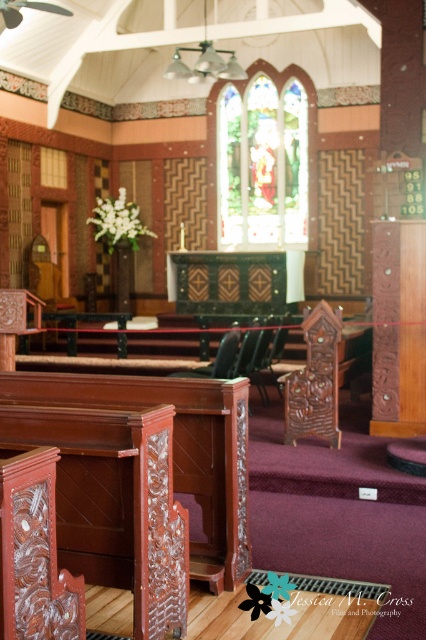
Question: Can you confirm if stained glass at center is thinner than wooden carved chair at center?

Choices:
 (A) yes
 (B) no

Answer: (B)

Question: Which point is closer to the camera?

Choices:
 (A) (273, 96)
 (B) (224, 356)

Answer: (B)

Question: Does stained glass at center lie behind wooden carved chair at center?

Choices:
 (A) no
 (B) yes

Answer: (B)

Question: Can you confirm if stained glass at center is positioned to the left of wooden carved chair at center?

Choices:
 (A) no
 (B) yes

Answer: (A)